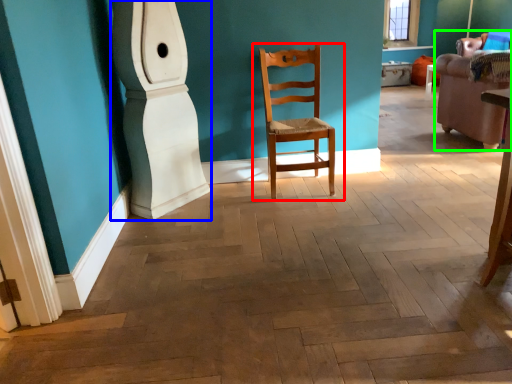
Question: Which object is the closest to the chair (highlighted by a red box)? Choose among these: pillar (highlighted by a blue box) or armchair (highlighted by a green box).

Choices:
 (A) pillar
 (B) armchair

Answer: (A)